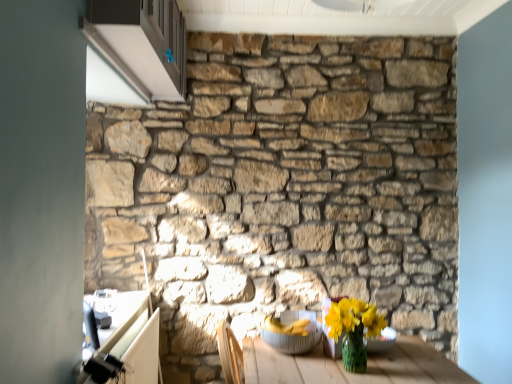
The height and width of the screenshot is (384, 512). What do you see at coordinates (282, 188) in the screenshot?
I see `natural stone wall at center` at bounding box center [282, 188].

Where is `metallic silver bowl at lower center, the 2th glass bowl viewed from the right`? This screenshot has width=512, height=384. metallic silver bowl at lower center, the 2th glass bowl viewed from the right is located at coordinates (293, 335).

Measure the distance between metallic silver bowl at lower center, which is counted as the first glass bowl, starting from the left, and camera.

The depth of metallic silver bowl at lower center, which is counted as the first glass bowl, starting from the left, is 5.81 feet.

Measure the distance between yellow matte vase at lower right and camera.

The depth of yellow matte vase at lower right is 1.70 meters.

Describe the element at coordinates (382, 341) in the screenshot. I see `translucent glass bowl at lower right, which appears as the 1th glass bowl when viewed from the right` at that location.

The image size is (512, 384). Identify the location of natural stone wall at center. (282, 188).

Which is more to the right, natural stone wall at center or translucent glass bowl at lower right, which is the second glass bowl in left-to-right order?

translucent glass bowl at lower right, which is the second glass bowl in left-to-right order.

At what (x,y) coordinates should I click in order to perform the action: click on brick above the translucent glass bowl at lower right, which is the second glass bowl in left-to-right order (from a real-world perspective). Please return your answer as a coordinate pair (x, y). This screenshot has width=512, height=384. Looking at the image, I should click on (282, 188).

Would you say natural stone wall at center contains translucent glass bowl at lower right, which is the second glass bowl in left-to-right order?

That's incorrect, translucent glass bowl at lower right, which is the second glass bowl in left-to-right order, is not inside natural stone wall at center.

What's the angular difference between natural stone wall at center and translucent glass bowl at lower right, which is the second glass bowl in left-to-right order,'s facing directions?

The facing directions of natural stone wall at center and translucent glass bowl at lower right, which is the second glass bowl in left-to-right order, are 2.45 degrees apart.

Is point (289, 322) positioned in front of point (328, 349)?

No, (289, 322) is further to viewer.

Based on their positions, is metallic silver bowl at lower center, which is counted as the first glass bowl, starting from the left, located to the left or right of translucent glass bowl at lower right, which is the second glass bowl in left-to-right order?

Based on their positions, metallic silver bowl at lower center, which is counted as the first glass bowl, starting from the left, is located to the left of translucent glass bowl at lower right, which is the second glass bowl in left-to-right order.

Is metallic silver bowl at lower center, the 2th glass bowl viewed from the right, placed right next to translucent glass bowl at lower right, which is the second glass bowl in left-to-right order?

No, metallic silver bowl at lower center, the 2th glass bowl viewed from the right, is not beside translucent glass bowl at lower right, which is the second glass bowl in left-to-right order.

Is metallic silver bowl at lower center, which is counted as the first glass bowl, starting from the left, inside or outside of translucent glass bowl at lower right, which is the second glass bowl in left-to-right order?

The correct answer is: outside.

Considering the points (339, 311) and (341, 345), which point is in front, point (339, 311) or point (341, 345)?

The point (341, 345) is closer.

From the image's perspective, which is above, yellow matte vase at lower right or translucent glass bowl at lower right, which appears as the 1th glass bowl when viewed from the right?

yellow matte vase at lower right, from the image's perspective.

Considering the positions of objects yellow matte vase at lower right and translucent glass bowl at lower right, which appears as the 1th glass bowl when viewed from the right, in the image provided, who is behind, yellow matte vase at lower right or translucent glass bowl at lower right, which appears as the 1th glass bowl when viewed from the right,?

Positioned behind is translucent glass bowl at lower right, which appears as the 1th glass bowl when viewed from the right.

Who is bigger, yellow matte vase at lower right or translucent glass bowl at lower right, which appears as the 1th glass bowl when viewed from the right?

Bigger between the two is yellow matte vase at lower right.

From the image's perspective, is translucent glass bowl at lower right, which is the second glass bowl in left-to-right order, located above or below white glossy cabinet at upper left?

translucent glass bowl at lower right, which is the second glass bowl in left-to-right order, is below white glossy cabinet at upper left.

Between translucent glass bowl at lower right, which is the second glass bowl in left-to-right order, and white glossy cabinet at upper left, which one is positioned behind?

Positioned behind is translucent glass bowl at lower right, which is the second glass bowl in left-to-right order.

Does translucent glass bowl at lower right, which appears as the 1th glass bowl when viewed from the right, appear on the left side of white glossy cabinet at upper left?

Incorrect, translucent glass bowl at lower right, which appears as the 1th glass bowl when viewed from the right, is not on the left side of white glossy cabinet at upper left.

Considering the relative sizes of translucent glass bowl at lower right, which appears as the 1th glass bowl when viewed from the right, and white glossy cabinet at upper left in the image provided, is translucent glass bowl at lower right, which appears as the 1th glass bowl when viewed from the right, taller than white glossy cabinet at upper left?

In fact, translucent glass bowl at lower right, which appears as the 1th glass bowl when viewed from the right, may be shorter than white glossy cabinet at upper left.

Considering the sizes of objects yellow matte vase at lower right and natural stone wall at center in the image provided, who is taller, yellow matte vase at lower right or natural stone wall at center?

Standing taller between the two is natural stone wall at center.

Where is `flower below the natural stone wall at center (from the image's perspective)`? flower below the natural stone wall at center (from the image's perspective) is located at coordinates (354, 318).

Is yellow matte vase at lower right oriented away from natural stone wall at center?

Absolutely, yellow matte vase at lower right is directed away from natural stone wall at center.

Would you say yellow matte vase at lower right is a long distance from natural stone wall at center?

Indeed, yellow matte vase at lower right is not near natural stone wall at center.

Considering the relative positions of metallic silver bowl at lower center, which is counted as the first glass bowl, starting from the left, and white glossy cabinet at upper left in the image provided, is metallic silver bowl at lower center, which is counted as the first glass bowl, starting from the left, to the left or to the right of white glossy cabinet at upper left?

metallic silver bowl at lower center, which is counted as the first glass bowl, starting from the left, is positioned on white glossy cabinet at upper left's right side.

Are metallic silver bowl at lower center, the 2th glass bowl viewed from the right, and white glossy cabinet at upper left far apart?

Yes.

How different are the orientations of metallic silver bowl at lower center, the 2th glass bowl viewed from the right, and white glossy cabinet at upper left in degrees?

There is a 90.7-degree angle between the facing directions of metallic silver bowl at lower center, the 2th glass bowl viewed from the right, and white glossy cabinet at upper left.

Does metallic silver bowl at lower center, the 2th glass bowl viewed from the right, lie behind white glossy cabinet at upper left?

Yes, it is.

The width and height of the screenshot is (512, 384). I want to click on brick lying behind the white glossy cabinet at upper left, so click(282, 188).

From the image's perspective, between white glossy cabinet at upper left and natural stone wall at center, which one is located above?

From the image's view, white glossy cabinet at upper left is above.

Between white glossy cabinet at upper left and natural stone wall at center, which one has more height?

With more height is natural stone wall at center.

Between white glossy cabinet at upper left and natural stone wall at center, which one has smaller width?

Thinner between the two is natural stone wall at center.

From a real-world perspective, count 2nd glass bowls downward from the natural stone wall at center and point to it. Please provide its 2D coordinates.

[(382, 341)]

Find the location of a particular element. This screenshot has height=384, width=512. glass bowl below the metallic silver bowl at lower center, the 2th glass bowl viewed from the right (from the image's perspective) is located at coordinates (382, 341).

Looking at the image, which one is located further to white glossy cabinet at upper left, natural stone wall at center or metallic silver bowl at lower center, the 2th glass bowl viewed from the right?

metallic silver bowl at lower center, the 2th glass bowl viewed from the right, is positioned further to the anchor white glossy cabinet at upper left.

Which object lies further to the anchor point natural stone wall at center, white glossy cabinet at upper left or yellow matte vase at lower right?

yellow matte vase at lower right lies further to natural stone wall at center than the other object.

Consider the image. Considering their positions, is translucent glass bowl at lower right, which is the second glass bowl in left-to-right order, positioned closer to yellow matte vase at lower right than white glossy cabinet at upper left?

Based on the image, translucent glass bowl at lower right, which is the second glass bowl in left-to-right order, appears to be nearer to yellow matte vase at lower right.

Based on their spatial positions, is white glossy cabinet at upper left or natural stone wall at center closer to yellow matte vase at lower right?

Based on the image, natural stone wall at center appears to be nearer to yellow matte vase at lower right.

Estimate the real-world distances between objects in this image. Which object is closer to translucent glass bowl at lower right, which appears as the 1th glass bowl when viewed from the right, metallic silver bowl at lower center, which is counted as the first glass bowl, starting from the left, or white glossy cabinet at upper left?

Among the two, metallic silver bowl at lower center, which is counted as the first glass bowl, starting from the left, is located nearer to translucent glass bowl at lower right, which appears as the 1th glass bowl when viewed from the right.

Estimate the real-world distances between objects in this image. Which object is further from natural stone wall at center, white glossy cabinet at upper left or translucent glass bowl at lower right, which is the second glass bowl in left-to-right order?

Among the two, translucent glass bowl at lower right, which is the second glass bowl in left-to-right order, is located further to natural stone wall at center.

Looking at the image, which one is located further to natural stone wall at center, metallic silver bowl at lower center, the 2th glass bowl viewed from the right, or yellow matte vase at lower right?

yellow matte vase at lower right is further to natural stone wall at center.

Estimate the real-world distances between objects in this image. Which object is further from natural stone wall at center, yellow matte vase at lower right or metallic silver bowl at lower center, the 2th glass bowl viewed from the right?

yellow matte vase at lower right.

Locate an element on the screen. The height and width of the screenshot is (384, 512). brick between white glossy cabinet at upper left and metallic silver bowl at lower center, the 2th glass bowl viewed from the right, from top to bottom is located at coordinates (282, 188).

Identify the location of brick between white glossy cabinet at upper left and yellow matte vase at lower right vertically. (282, 188).

Where is `glass bowl positioned between metallic silver bowl at lower center, which is counted as the first glass bowl, starting from the left, and natural stone wall at center from near to far`? This screenshot has height=384, width=512. glass bowl positioned between metallic silver bowl at lower center, which is counted as the first glass bowl, starting from the left, and natural stone wall at center from near to far is located at coordinates 382,341.

Where is `glass bowl between white glossy cabinet at upper left and translucent glass bowl at lower right, which appears as the 1th glass bowl when viewed from the right, in the up-down direction`? glass bowl between white glossy cabinet at upper left and translucent glass bowl at lower right, which appears as the 1th glass bowl when viewed from the right, in the up-down direction is located at coordinates (293, 335).